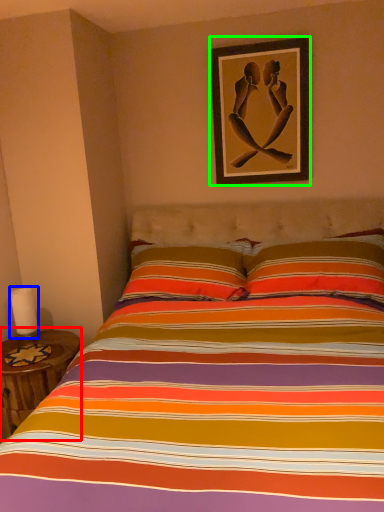
Question: Which object is the closest to the table (highlighted by a red box)? Choose among these: candle (highlighted by a blue box) or picture frame (highlighted by a green box).

Choices:
 (A) candle
 (B) picture frame

Answer: (A)